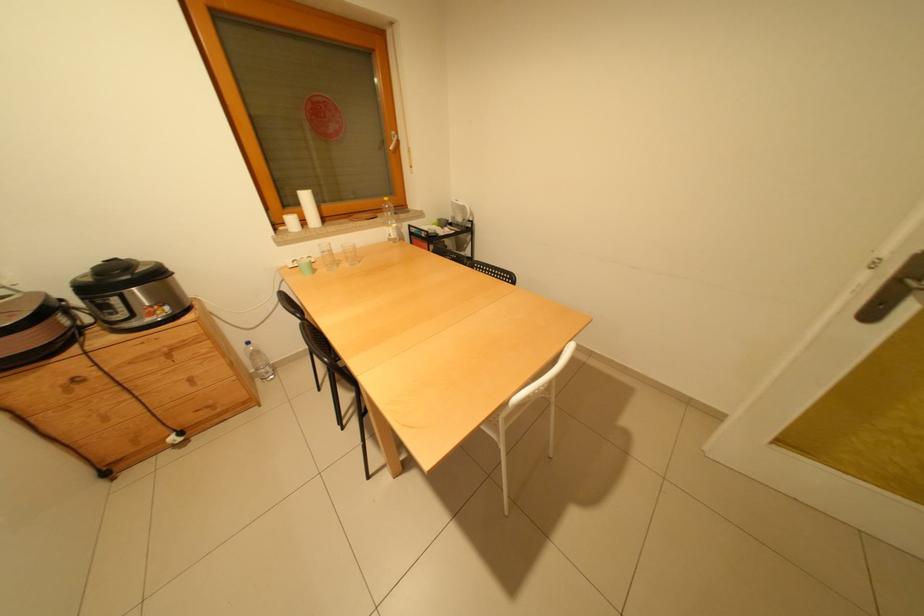
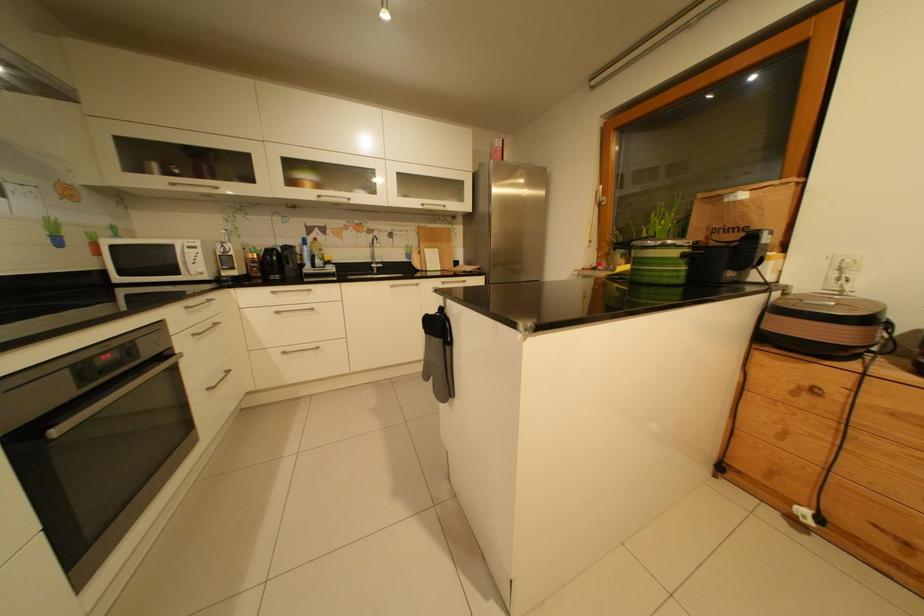
Based on the continuous images, in which direction is the camera rotating?

The camera rotated toward left-down.